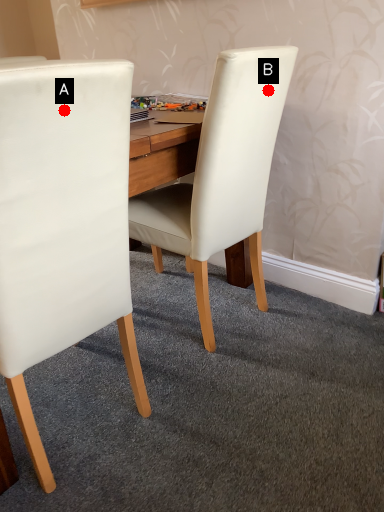
Question: Two points are circled on the image, labeled by A and B beside each circle. Which point is further to the camera?

Choices:
 (A) A is further
 (B) B is further

Answer: (B)